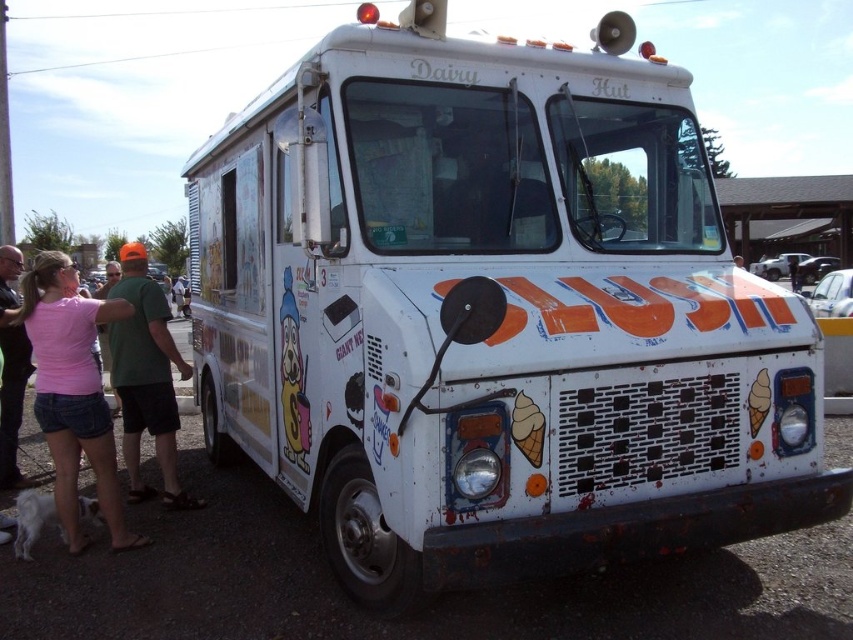
Is point (16, 385) farther from camera compared to point (22, 506)?

Yes, it is behind point (22, 506).

Describe the element at coordinates (12, 401) in the screenshot. I see `pink fabric shirt at left` at that location.

Measure the distance between point (22, 480) and camera.

Point (22, 480) is 6.20 meters away from camera.

Identify the location of pink fabric shirt at left. This screenshot has height=640, width=853. pyautogui.click(x=12, y=401).

Measure the distance from green fabric shirt at left to white fur dog at lower left.

37.04 inches

Does green fabric shirt at left appear on the right side of white fur dog at lower left?

Correct, you'll find green fabric shirt at left to the right of white fur dog at lower left.

Describe the element at coordinates (146, 378) in the screenshot. This screenshot has height=640, width=853. I see `green fabric shirt at left` at that location.

In order to click on green fabric shirt at left in this screenshot , I will do `click(146, 378)`.

Locate an element on the screen. The width and height of the screenshot is (853, 640). pink fabric shirt at lower left is located at coordinates (73, 392).

Does pink fabric shirt at lower left appear over green fabric shirt at left?

Indeed, pink fabric shirt at lower left is positioned over green fabric shirt at left.

Which is in front, point (97, 378) or point (178, 506)?

Point (97, 378)

Where is `pink fabric shirt at lower left`? The image size is (853, 640). pink fabric shirt at lower left is located at coordinates (73, 392).